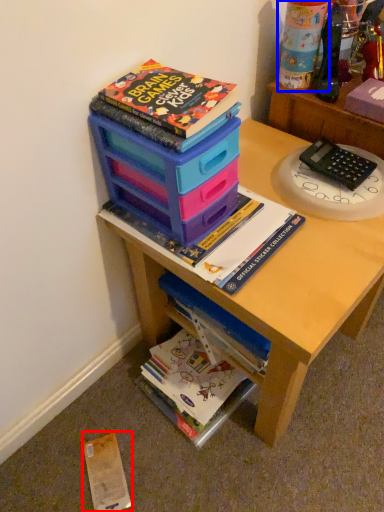
Question: Which point is further to the camera, paperback book (highlighted by a red box) or toy (highlighted by a blue box)?

Choices:
 (A) paperback book
 (B) toy

Answer: (A)